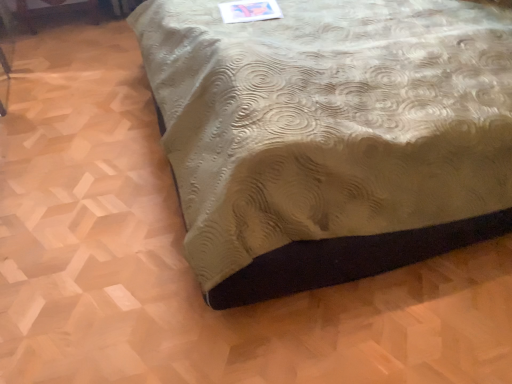
The width and height of the screenshot is (512, 384). In order to click on satin beige bed at center in this screenshot , I will do `click(331, 136)`.

Describe the element at coordinates (331, 136) in the screenshot. This screenshot has width=512, height=384. I see `satin beige bed at center` at that location.

Find the location of `satin beige bed at center`. satin beige bed at center is located at coordinates (331, 136).